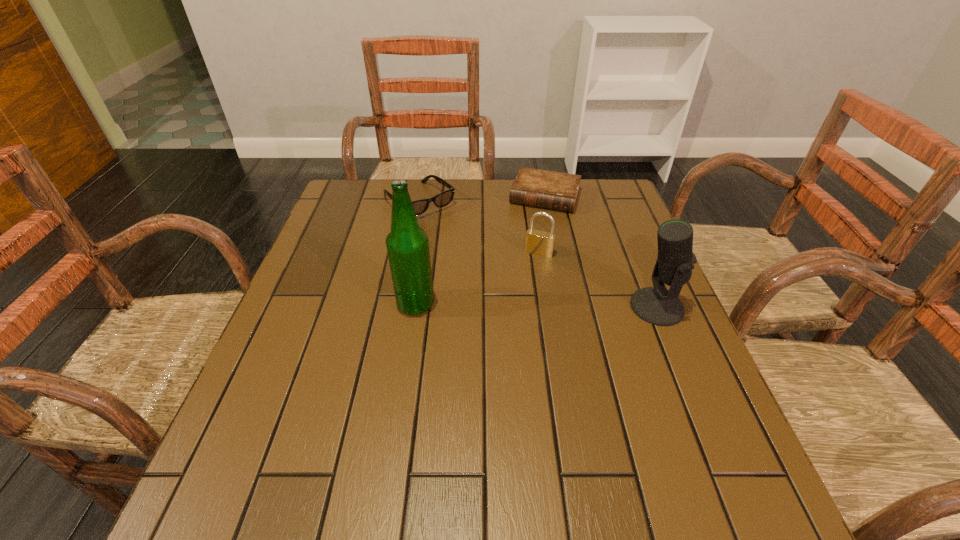
Identify the location of spectacles that is at the far edge. (442, 199).

Identify the location of object that is at the left edge. (442, 199).

Find the location of a particular element. microphone positioned at the right edge is located at coordinates (656, 305).

Identify the location of diary positioned at the right edge. (546, 189).

This screenshot has width=960, height=540. What are the coordinates of `object at the far left corner` in the screenshot? It's located at (442, 199).

Locate an element on the screen. object that is at the far right corner is located at coordinates (546, 189).

Where is `free space at the far edge of the desktop`? The width and height of the screenshot is (960, 540). free space at the far edge of the desktop is located at coordinates (456, 214).

In the image, there is a desktop. What are the coordinates of `vacant space at the near edge` in the screenshot? It's located at (332, 435).

The width and height of the screenshot is (960, 540). What are the coordinates of `vacant region at the left edge of the desktop` in the screenshot? It's located at (361, 228).

Locate an element on the screen. vacant space at the right edge is located at coordinates (594, 235).